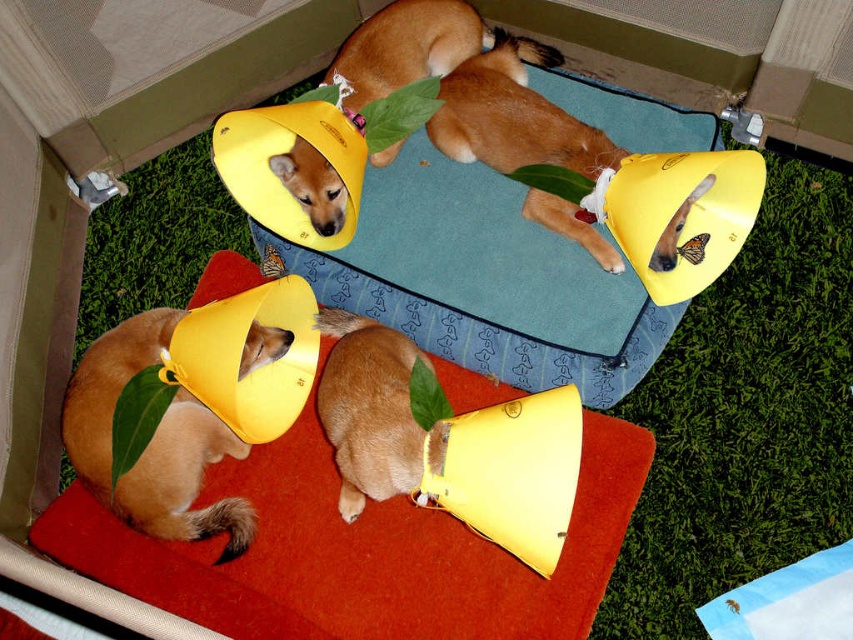
Question: Is golden fur dog at lower left positioned at the back of light brown fur at center?

Choices:
 (A) yes
 (B) no

Answer: (A)

Question: Does blue fabric dog bed at center have a lesser width compared to matte yellow cone at center?

Choices:
 (A) no
 (B) yes

Answer: (A)

Question: Which point is farther to the camera?

Choices:
 (A) light brown fur at center
 (B) golden fur dog at lower left
 (C) soft orange carpet at lower center

Answer: (C)

Question: Which object is the closest to the blue fabric dog bed at center?

Choices:
 (A) matte yellow cone at center
 (B) light brown fur at center
 (C) golden fur dog at lower left

Answer: (A)

Question: Which of the following is the farthest from the observer?

Choices:
 (A) (461, 579)
 (B) (508, 147)
 (C) (90, 368)
 (D) (323, 316)

Answer: (B)

Question: Can you confirm if blue fabric dog bed at center is smaller than light brown fur at center?

Choices:
 (A) no
 (B) yes

Answer: (A)